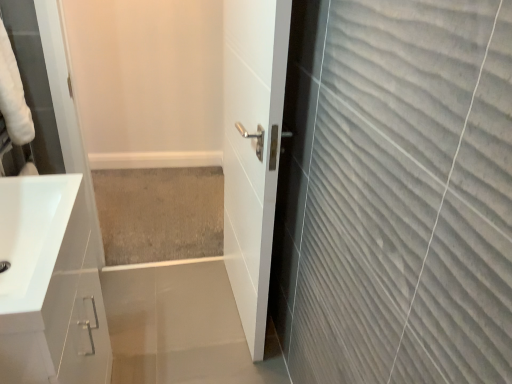
Question: Considering the relative positions of white glossy door at center and beige carpet at center in the image provided, is white glossy door at center to the left or to the right of beige carpet at center?

Choices:
 (A) left
 (B) right

Answer: (B)

Question: Relative to beige carpet at center, is white glossy door at center in front or behind?

Choices:
 (A) front
 (B) behind

Answer: (A)

Question: Which object is positioned farthest from the white glossy sink at lower left?

Choices:
 (A) white glossy door at center
 (B) beige carpet at center

Answer: (B)

Question: Which object is positioned farthest from the beige carpet at center?

Choices:
 (A) white glossy door at center
 (B) white glossy sink at lower left

Answer: (B)